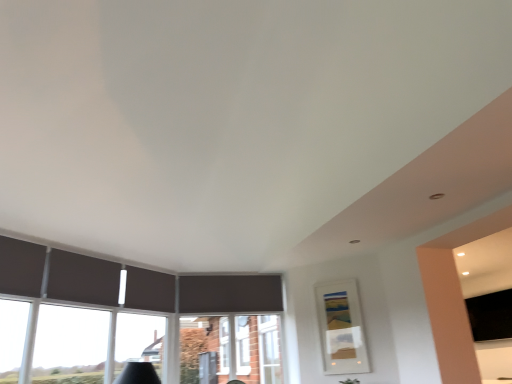
Question: Can you confirm if white plastic window frame at center is shorter than black matte tv at right?

Choices:
 (A) no
 (B) yes

Answer: (A)

Question: Is the surface of white plastic window frame at center in direct contact with black matte tv at right?

Choices:
 (A) yes
 (B) no

Answer: (B)

Question: From a real-world perspective, does white plastic window frame at center sit lower than black matte tv at right?

Choices:
 (A) no
 (B) yes

Answer: (B)

Question: Considering the relative positions of white plastic window frame at center and black matte tv at right in the image provided, is white plastic window frame at center behind black matte tv at right?

Choices:
 (A) yes
 (B) no

Answer: (B)

Question: Does white plastic window frame at center have a greater height compared to black matte tv at right?

Choices:
 (A) yes
 (B) no

Answer: (A)

Question: Is black matte tv at right at the back of white plastic window frame at center?

Choices:
 (A) no
 (B) yes

Answer: (A)

Question: Is matte white picture frame at center-right in front of transparent glass window at lower left?

Choices:
 (A) no
 (B) yes

Answer: (A)

Question: Is matte white picture frame at center-right turned away from transparent glass window at lower left?

Choices:
 (A) no
 (B) yes

Answer: (A)

Question: Is matte white picture frame at center-right thinner than transparent glass window at lower left?

Choices:
 (A) no
 (B) yes

Answer: (B)

Question: Could you tell me if matte white picture frame at center-right is facing transparent glass window at lower left?

Choices:
 (A) yes
 (B) no

Answer: (B)

Question: Is matte white picture frame at center-right positioned far away from transparent glass window at lower left?

Choices:
 (A) yes
 (B) no

Answer: (A)

Question: From the image's perspective, is matte white picture frame at center-right located beneath transparent glass window at lower left?

Choices:
 (A) yes
 (B) no

Answer: (A)

Question: Is transparent glass window at lower left closer to the viewer compared to black matte tv at right?

Choices:
 (A) yes
 (B) no

Answer: (A)